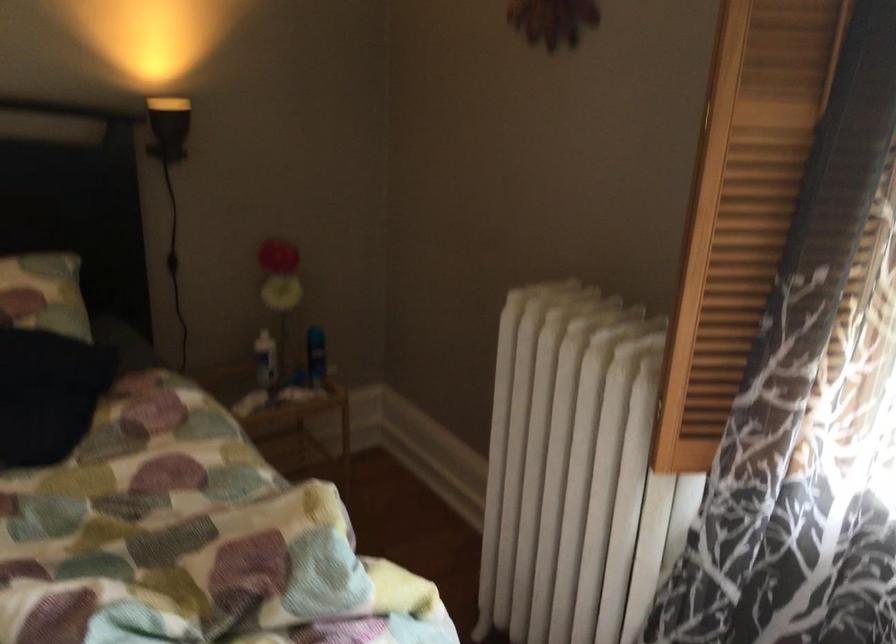
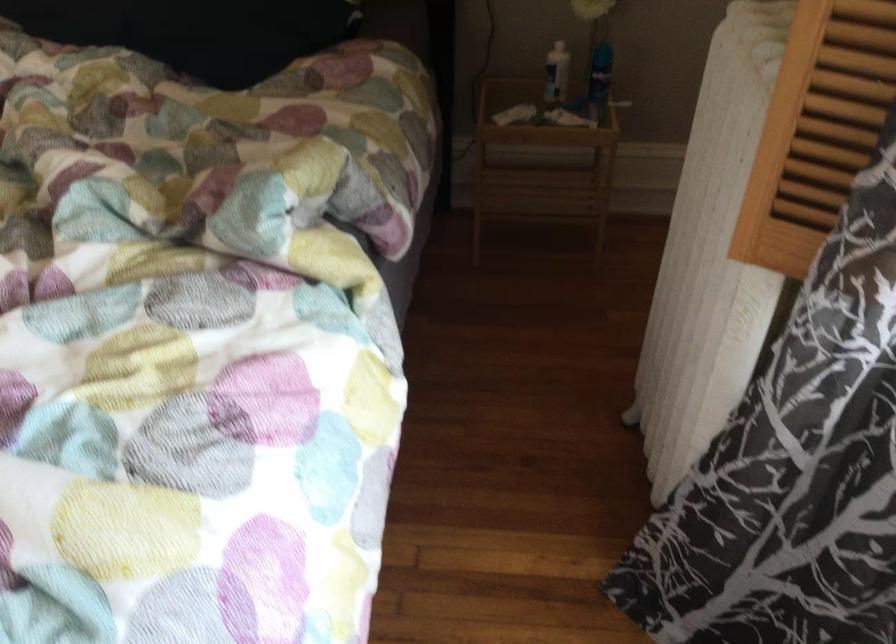
The point at (703, 382) is marked in the first image. Where is the corresponding point in the second image?

(815, 129)